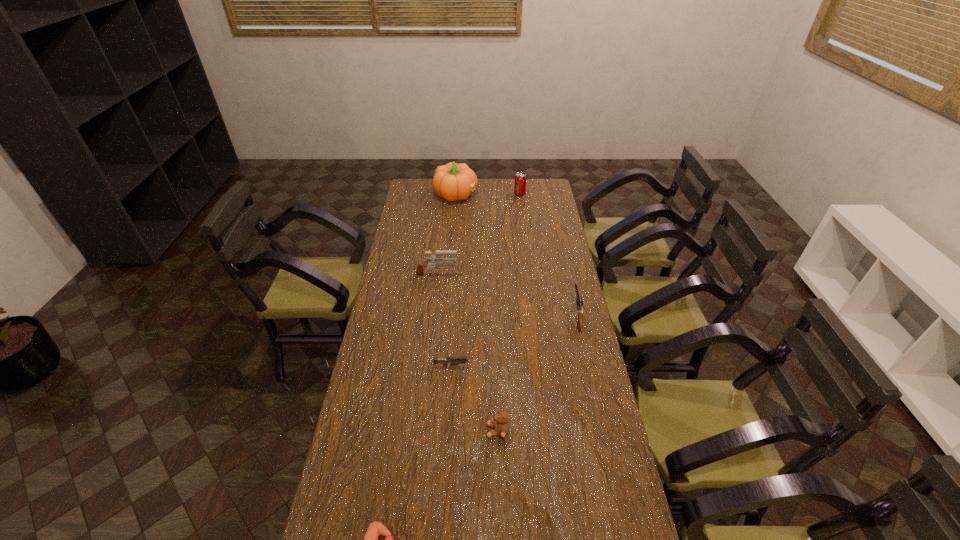
Locate an element on the screen. This screenshot has width=960, height=540. vacant region located on the carved face of the pumpkin is located at coordinates (515, 194).

You are a GUI agent. You are given a task and a screenshot of the screen. Output one action in this format:
    pyautogui.click(x=<x>, y=<y>)
    Task: Click on the vacant space located 0.230m at the barrel end of the tallest gun
    
    Given the screenshot: What is the action you would take?
    pyautogui.click(x=509, y=276)

Locate an element on the screen. free spot located on the right of the second object from right to left is located at coordinates (548, 194).

Image resolution: width=960 pixels, height=540 pixels. I want to click on vacant space located 0.320m along the barrel of the fourth farthest object, so click(563, 254).

The image size is (960, 540). In order to click on free space located 0.350m along the barrel of the fourth farthest object in this screenshot , I will do `click(562, 251)`.

You are a GUI agent. You are given a task and a screenshot of the screen. Output one action in this format:
    pyautogui.click(x=<x>, y=<y>)
    Task: Click on the free space located along the barrel of the fourth farthest object
    
    Given the screenshot: What is the action you would take?
    pyautogui.click(x=565, y=271)

The height and width of the screenshot is (540, 960). I want to click on free space located on the front-facing side of the fifth object from left to right, so click(x=411, y=430).

Locate an element on the screen. The width and height of the screenshot is (960, 540). free region located on the front-facing side of the fifth object from left to right is located at coordinates point(462,430).

This screenshot has width=960, height=540. In order to click on vacant space located on the front-facing side of the fifth object from left to right in this screenshot , I will do `click(393, 430)`.

Locate an element on the screen. vacant region located 0.210m aimed along the barrel of the nearest gun is located at coordinates (537, 366).